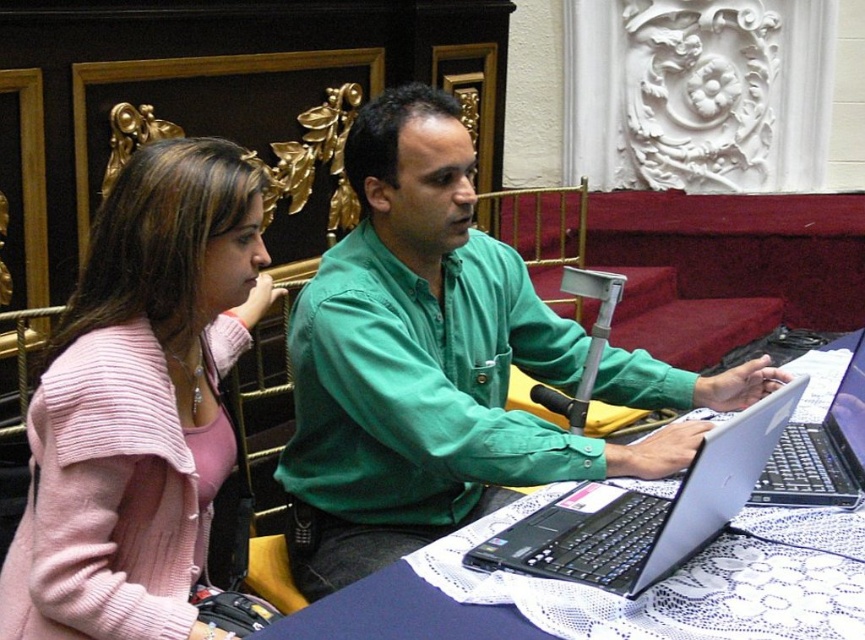
Based on the photo, who is higher up, pink knitted sweater at upper left or black plastic laptop at center?

pink knitted sweater at upper left is higher up.

Can you confirm if pink knitted sweater at upper left is positioned below black plastic laptop at center?

No, pink knitted sweater at upper left is not below black plastic laptop at center.

Locate an element on the screen. The width and height of the screenshot is (865, 640). pink knitted sweater at upper left is located at coordinates (139, 403).

Can you confirm if pink knitted sweater at upper left is taller than white lace table at center?

Indeed, pink knitted sweater at upper left has a greater height compared to white lace table at center.

Does pink knitted sweater at upper left appear over white lace table at center?

Yes, pink knitted sweater at upper left is above white lace table at center.

Which is in front, point (106, 608) or point (812, 563)?

Positioned in front is point (106, 608).

Where is `pink knitted sweater at upper left`? The height and width of the screenshot is (640, 865). pink knitted sweater at upper left is located at coordinates (139, 403).

Who is more forward, (370, 541) or (837, 486)?

Point (837, 486) is in front.

Based on the photo, measure the distance from green matte shirt at center to black plastic laptop at center.

green matte shirt at center and black plastic laptop at center are 49.92 centimeters apart from each other.

Who is more forward, (453, 177) or (843, 448)?

Point (843, 448) is in front.

This screenshot has height=640, width=865. Find the location of `green matte shirt at center`. green matte shirt at center is located at coordinates (425, 362).